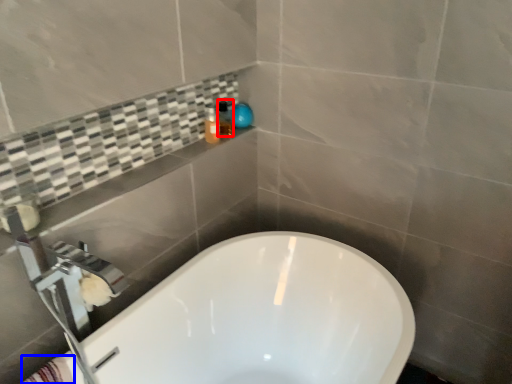
Question: Among these objects, which one is farthest to the camera, toiletry (highlighted by a red box) or bath towel (highlighted by a blue box)?

Choices:
 (A) toiletry
 (B) bath towel

Answer: (A)